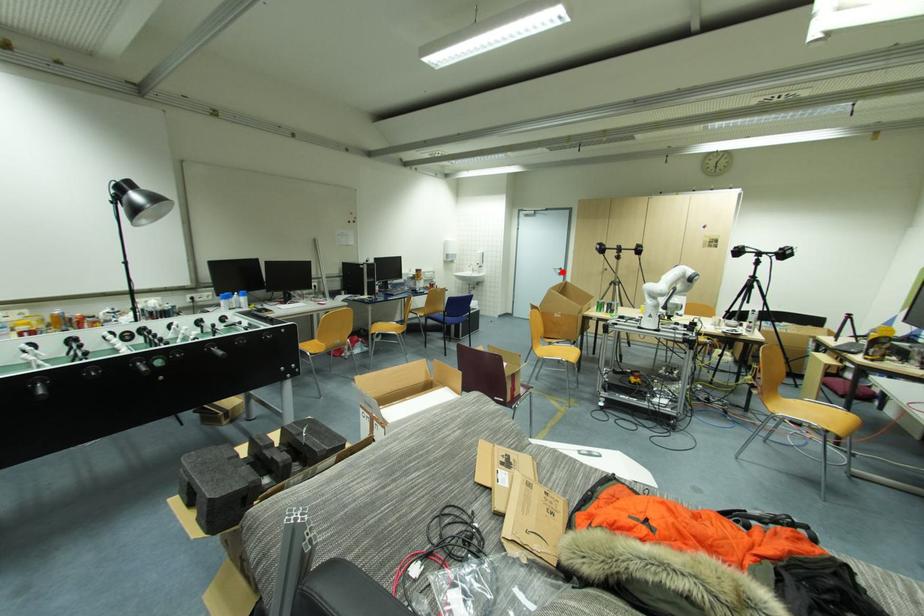
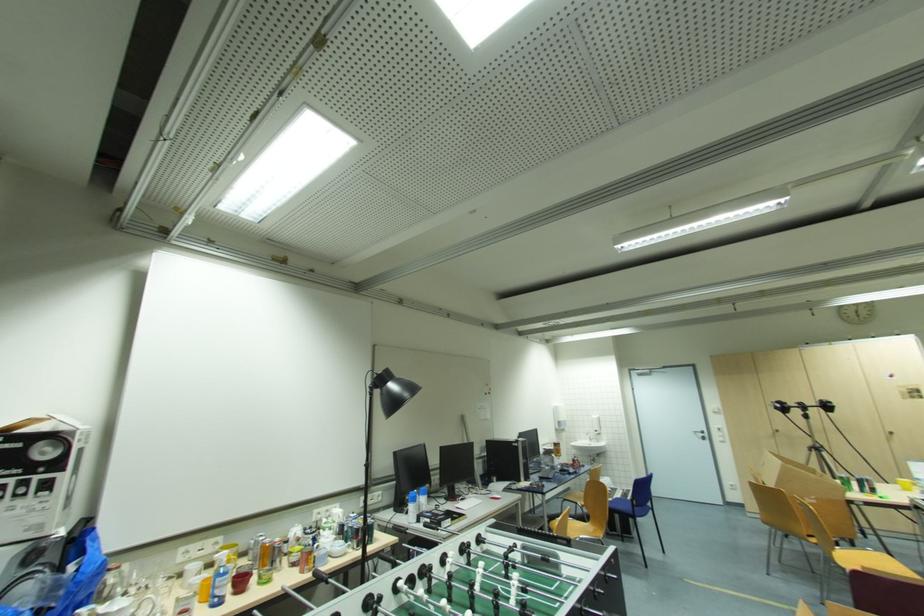
Locate, in the second image, the point that corresponds to the highlighted location in the first image.

(706, 436)